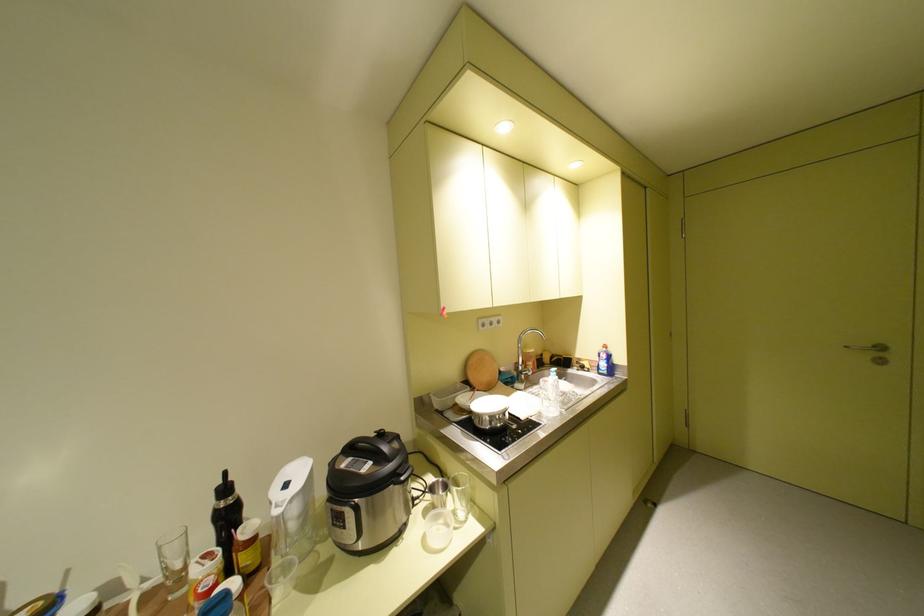
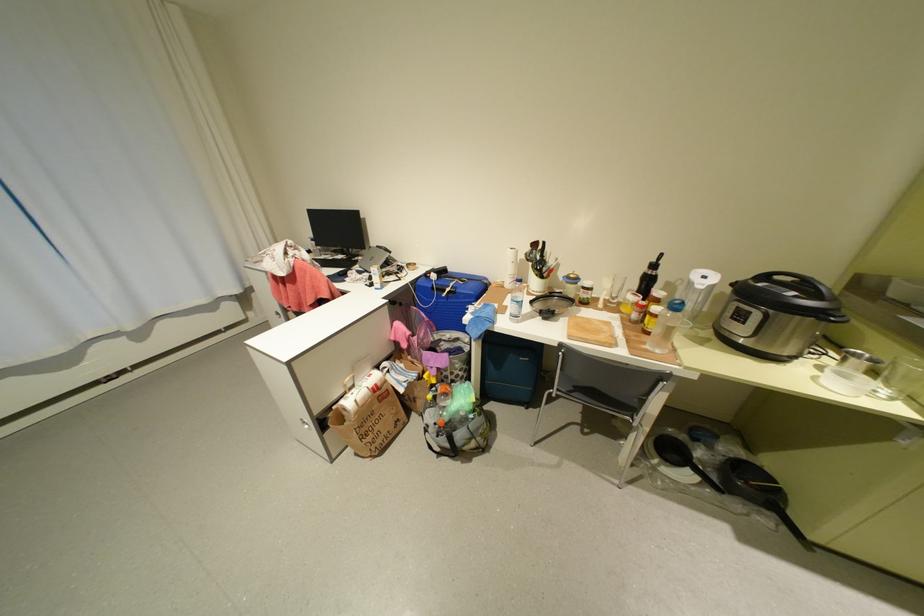
Where in the second image is the point corresponding to pixel 434 541 from the first image?

(824, 379)